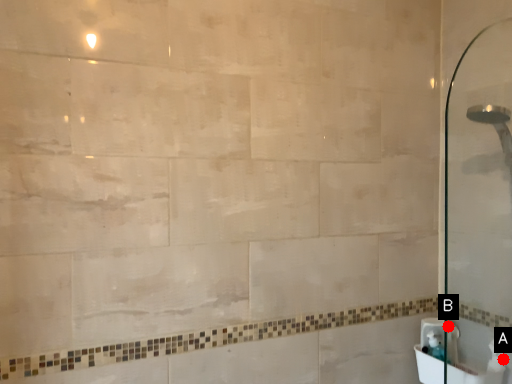
Question: Two points are circled on the image, labeled by A and B beside each circle. Which point is further to the camera?

Choices:
 (A) A is further
 (B) B is further

Answer: (B)